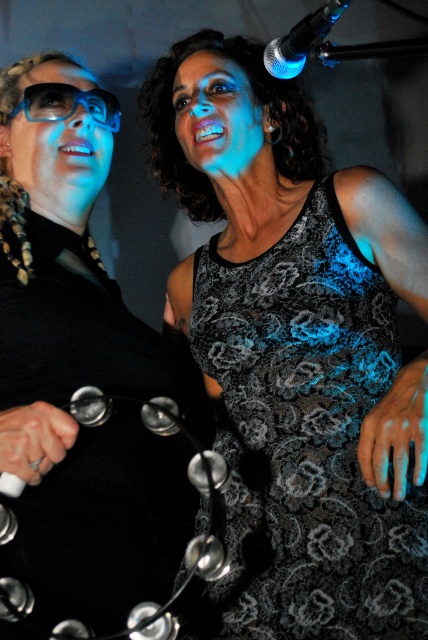
Question: Observing the image, what is the correct spatial positioning of black lace dress at center in reference to matte black glasses at left?

Choices:
 (A) above
 (B) below

Answer: (B)

Question: Which of the following is the farthest from the observer?

Choices:
 (A) black lace dress at upper right
 (B) black lace dress at center
 (C) matte black glasses at left

Answer: (C)

Question: Can you confirm if black lace dress at center is positioned above matte black glasses at left?

Choices:
 (A) no
 (B) yes

Answer: (A)

Question: Which of the following is the closest to the observer?

Choices:
 (A) (82, 433)
 (B) (347, 481)

Answer: (A)

Question: Does black lace dress at center appear over matte black glasses at left?

Choices:
 (A) no
 (B) yes

Answer: (A)

Question: Which of these objects is positioned farthest from the black lace dress at center?

Choices:
 (A) matte black glasses at left
 (B) black lace dress at upper right

Answer: (A)